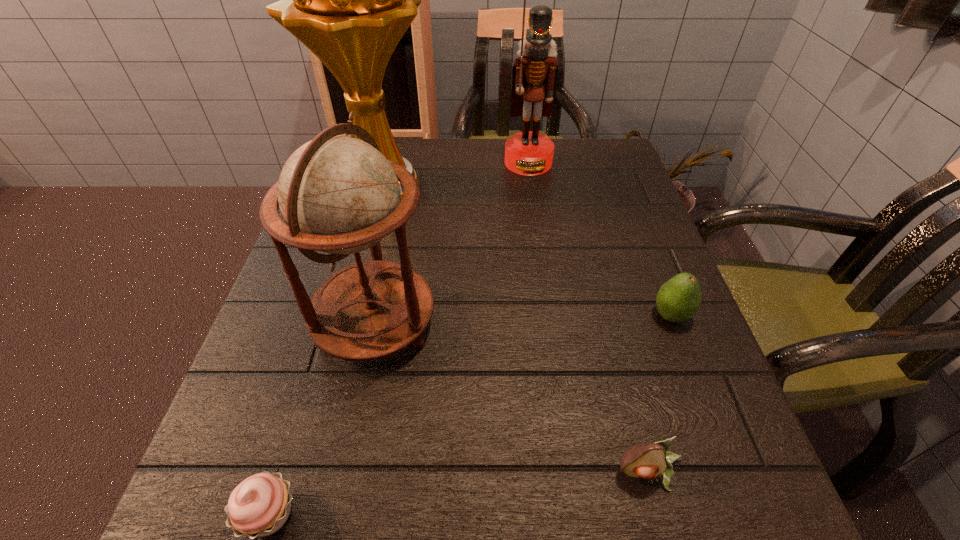
Identify the location of trophy_cup. (349, 0).

This screenshot has width=960, height=540. What are the coordinates of `the fifth shortest object` in the screenshot? It's located at (534, 73).

What are the coordinates of `the fourth shortest object` in the screenshot? It's located at (338, 194).

Locate an element on the screen. This screenshot has width=960, height=540. the rightmost object is located at coordinates (678, 300).

Identify the location of the right avocado. Image resolution: width=960 pixels, height=540 pixels. (678, 300).

Locate an element on the screen. This screenshot has height=540, width=960. the nearer avocado is located at coordinates (644, 460).

Where is `vacant space situated 0.220m at the front of the trophy_cup where the globe is prominent`? vacant space situated 0.220m at the front of the trophy_cup where the globe is prominent is located at coordinates (532, 186).

The height and width of the screenshot is (540, 960). Identify the location of vacant position located 0.090m on the front-facing side of the nutcracker. (533, 197).

At what (x,y) coordinates should I click in order to perform the action: click on vacant area located 0.130m on the surface of the fourth shortest object. Please return your answer as a coordinate pair (x, y). The width and height of the screenshot is (960, 540). Looking at the image, I should click on (508, 324).

You are a GUI agent. You are given a task and a screenshot of the screen. Output one action in this format:
    pyautogui.click(x=<x>, y=<y>)
    Task: Click on the vacant space located on the front of the rightmost object
    The image size is (960, 540).
    Given the screenshot: What is the action you would take?
    pyautogui.click(x=736, y=485)